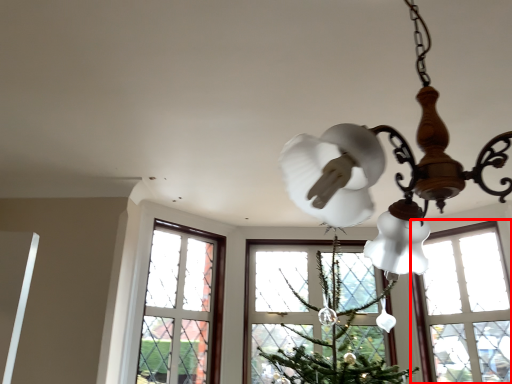
Question: From the image's perspective, where is window (annotated by the red box) located in relation to lamp in the image?

Choices:
 (A) below
 (B) above

Answer: (A)